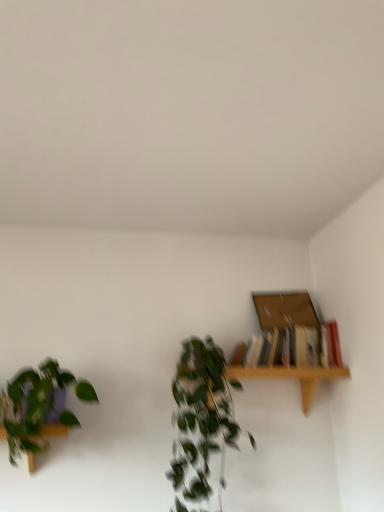
Question: Should I look upward or downward to see green matte plant at left, the first houseplant positioned from the left?

Choices:
 (A) up
 (B) down

Answer: (B)

Question: Is green leafy plant at center, which is counted as the second houseplant, starting from the left, at the right side of light wood shelf at upper right?

Choices:
 (A) no
 (B) yes

Answer: (A)

Question: From a real-world perspective, is green leafy plant at center, marked as the 1th houseplant in a right-to-left arrangement, physically below light wood shelf at upper right?

Choices:
 (A) yes
 (B) no

Answer: (A)

Question: Is light wood shelf at upper right completely or partially inside green leafy plant at center, marked as the 1th houseplant in a right-to-left arrangement?

Choices:
 (A) yes
 (B) no

Answer: (B)

Question: Does green leafy plant at center, which is counted as the second houseplant, starting from the left, have a greater height compared to light wood shelf at upper right?

Choices:
 (A) no
 (B) yes

Answer: (B)

Question: Does green leafy plant at center, which is counted as the second houseplant, starting from the left, have a lesser width compared to light wood shelf at upper right?

Choices:
 (A) no
 (B) yes

Answer: (A)

Question: From a real-world perspective, is green leafy plant at center, marked as the 1th houseplant in a right-to-left arrangement, over light wood shelf at upper right?

Choices:
 (A) no
 (B) yes

Answer: (A)

Question: Is light wood shelf at upper right closer to the viewer compared to brown cardboard box at upper right?

Choices:
 (A) yes
 (B) no

Answer: (A)

Question: Can you see light wood shelf at upper right touching brown cardboard box at upper right?

Choices:
 (A) yes
 (B) no

Answer: (B)

Question: From the image's perspective, is light wood shelf at upper right above brown cardboard box at upper right?

Choices:
 (A) no
 (B) yes

Answer: (A)

Question: From a real-world perspective, is light wood shelf at upper right physically below brown cardboard box at upper right?

Choices:
 (A) yes
 (B) no

Answer: (A)

Question: Can we say light wood shelf at upper right lies outside brown cardboard box at upper right?

Choices:
 (A) no
 (B) yes

Answer: (B)

Question: From a real-world perspective, is light wood shelf at upper right over brown cardboard box at upper right?

Choices:
 (A) yes
 (B) no

Answer: (B)

Question: From a real-world perspective, is green leafy plant at center, which is counted as the second houseplant, starting from the left, beneath hardcover books at upper right?

Choices:
 (A) no
 (B) yes

Answer: (B)